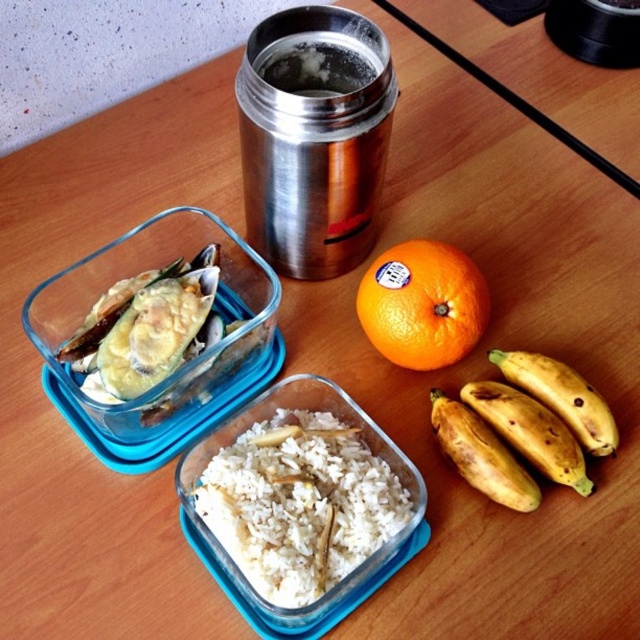
Question: Which of the following is the farthest from the observer?

Choices:
 (A) (547, 396)
 (B) (404, 524)

Answer: (A)

Question: Is brown spotted bananas at lower right wider than ripe yellow banana at lower right?

Choices:
 (A) yes
 (B) no

Answer: (A)

Question: Which object appears closest to the camera in this image?

Choices:
 (A) yellow matte bananas at lower right
 (B) orangesmoothobject at center
 (C) white matte rice at center
 (D) brown spotted bananas at lower right

Answer: (C)

Question: Which object is closer to the camera taking this photo?

Choices:
 (A) white matte rice at center
 (B) yellow matte bananas at lower right
 (C) brown spotted bananas at lower right

Answer: (A)

Question: Does orangesmoothobject at center have a larger size compared to ripe yellow banana at lower right?

Choices:
 (A) yes
 (B) no

Answer: (A)

Question: Is the position of brown spotted bananas at lower right less distant than that of yellow matte bananas at lower right?

Choices:
 (A) yes
 (B) no

Answer: (B)